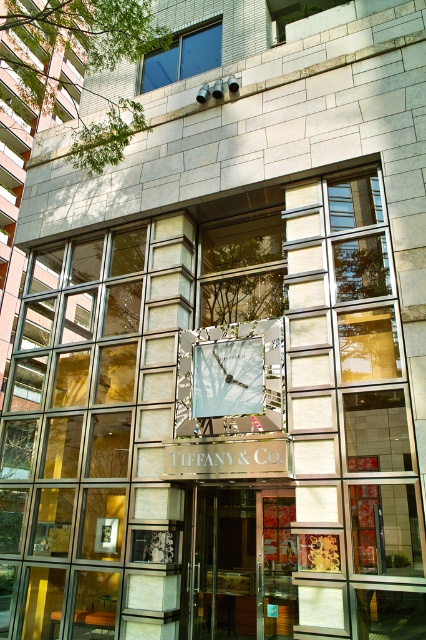
Question: Does transparent glass door at center appear on the right side of matte silver clock at center?

Choices:
 (A) no
 (B) yes

Answer: (B)

Question: Among these points, which one is farthest from the camera?

Choices:
 (A) (196, 364)
 (B) (226, 572)

Answer: (B)

Question: Among these objects, which one is farthest from the camera?

Choices:
 (A) matte silver clock at center
 (B) transparent glass door at center

Answer: (B)

Question: Is transparent glass door at center to the left of matte silver clock at center from the viewer's perspective?

Choices:
 (A) yes
 (B) no

Answer: (B)

Question: Is transparent glass door at center above matte silver clock at center?

Choices:
 (A) yes
 (B) no

Answer: (B)

Question: Which point is farther from the camera taking this photo?

Choices:
 (A) (207, 416)
 (B) (229, 611)

Answer: (B)